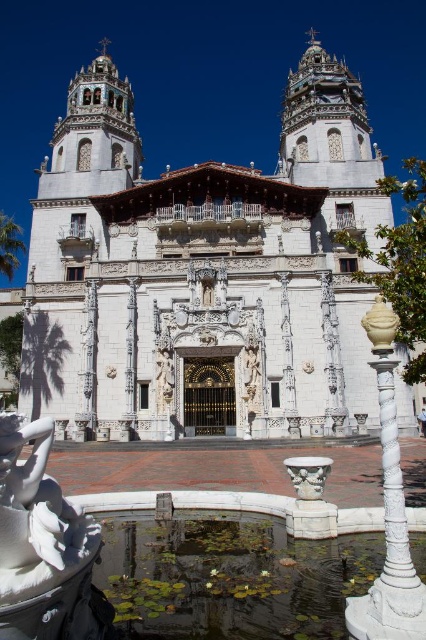
Between white marble church at center and white marble statue at lower left, which one has more height?

Standing taller between the two is white marble church at center.

This screenshot has width=426, height=640. Find the location of `white marble church at center`. white marble church at center is located at coordinates (203, 273).

Measure the distance between point (97,436) and camera.

Point (97,436) and camera are 61.18 meters apart.

The height and width of the screenshot is (640, 426). Find the location of `white marble church at center`. white marble church at center is located at coordinates (203, 273).

Which is more to the right, white marble church at center or green leafy pond at lower center?

green leafy pond at lower center is more to the right.

Can you confirm if white marble church at center is shorter than green leafy pond at lower center?

In fact, white marble church at center may be taller than green leafy pond at lower center.

Is point (127, 208) positioned in front of point (98, 568)?

No, (127, 208) is further to viewer.

Find the location of `white marble church at center`. white marble church at center is located at coordinates (203, 273).

Can you confirm if green leafy pond at lower center is positioned to the left of white marble statue at lower left?

Incorrect, green leafy pond at lower center is not on the left side of white marble statue at lower left.

Find the location of a particular element. Image resolution: width=426 pixels, height=640 pixels. green leafy pond at lower center is located at coordinates 230,566.